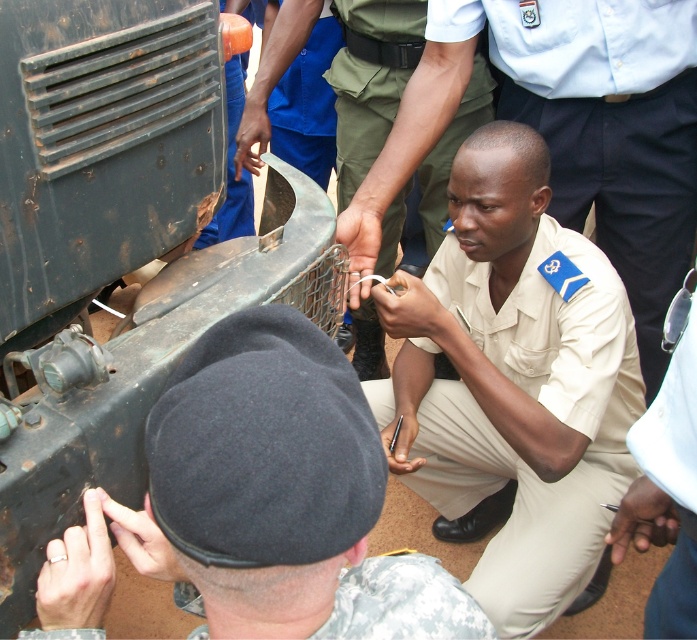
You are standing at the position of the person pointing at the vehicle. You need to move to both the point at coordinates point(562, 26) and point(245, 230). Which point should you reach first to follow the shortest path?

You should reach point(562, 26) first because it is closer to your current position than point(245, 230).

You are a photographer positioned at the origin point of the image. You want to capture a closeup of the camouflage fabric beret at lower left. Which direction should you move your camera to focus on it?

The camouflage fabric beret at lower left is located at point 0.942 in the x coordinate and 0.577 in the y coordinate. Since the origin is typically the bottom left corner of an image, moving your camera to the right along the x axis and slightly up along the y axis would position it towards the beret.